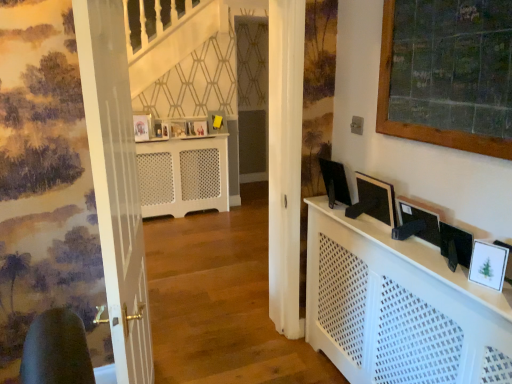
Question: From a real-world perspective, is matte yellow picture frame at center, arranged as the 4th picture frame when viewed from the left, located higher than matte wooden picture frame at upper center, the 5th picture frame positioned from the right?

Choices:
 (A) yes
 (B) no

Answer: (A)

Question: From the image's perspective, would you say matte yellow picture frame at center, which is the 1th picture frame in top-to-bottom order, is shown under matte wooden picture frame at upper center, the 2th picture frame viewed from the front?

Choices:
 (A) no
 (B) yes

Answer: (A)

Question: Considering the relative sizes of matte yellow picture frame at center, marked as the second picture frame in a right-to-left arrangement, and matte wooden picture frame at upper center, the 2th picture frame viewed from the front, in the image provided, is matte yellow picture frame at center, marked as the second picture frame in a right-to-left arrangement, smaller than matte wooden picture frame at upper center, the 2th picture frame viewed from the front,?

Choices:
 (A) yes
 (B) no

Answer: (B)

Question: Is matte yellow picture frame at center, which appears as the first picture frame when viewed from the back, not close to matte wooden picture frame at upper center, the 1th picture frame when ordered from left to right?

Choices:
 (A) yes
 (B) no

Answer: (B)

Question: Can you confirm if matte yellow picture frame at center, which appears as the first picture frame when viewed from the back, is thinner than matte wooden picture frame at upper center, which appears as the 4th picture frame when viewed from the back?

Choices:
 (A) yes
 (B) no

Answer: (B)

Question: Is matte wooden picture frame at upper center, which is counted as the 4th picture frame, starting from the top, surrounded by matte yellow picture frame at center, which is the 5th picture frame in front-to-back order?

Choices:
 (A) yes
 (B) no

Answer: (B)

Question: Can you confirm if matte yellow picture frame at center, which is the 5th picture frame in front-to-back order, is wider than wooden framed chalkboard at upper right?

Choices:
 (A) no
 (B) yes

Answer: (B)

Question: From the image's perspective, is matte yellow picture frame at center, arranged as the 4th picture frame when viewed from the left, beneath wooden framed chalkboard at upper right?

Choices:
 (A) no
 (B) yes

Answer: (A)

Question: Is matte yellow picture frame at center, which is the 5th picture frame in front-to-back order, bigger than wooden framed chalkboard at upper right?

Choices:
 (A) yes
 (B) no

Answer: (B)

Question: From a real-world perspective, is matte yellow picture frame at center, marked as the second picture frame in a right-to-left arrangement, physically below wooden framed chalkboard at upper right?

Choices:
 (A) yes
 (B) no

Answer: (A)

Question: Considering the relative sizes of matte yellow picture frame at center, arranged as the 4th picture frame when viewed from the left, and wooden framed chalkboard at upper right in the image provided, is matte yellow picture frame at center, arranged as the 4th picture frame when viewed from the left, thinner than wooden framed chalkboard at upper right?

Choices:
 (A) yes
 (B) no

Answer: (B)

Question: Is matte yellow picture frame at center, which is the 1th picture frame in top-to-bottom order, shorter than wooden framed chalkboard at upper right?

Choices:
 (A) no
 (B) yes

Answer: (B)

Question: Is matte white picture frame at center, the 2th picture frame viewed from the top, shorter than matte wooden picture frame at center, the third picture frame when ordered from bottom to top?

Choices:
 (A) yes
 (B) no

Answer: (B)